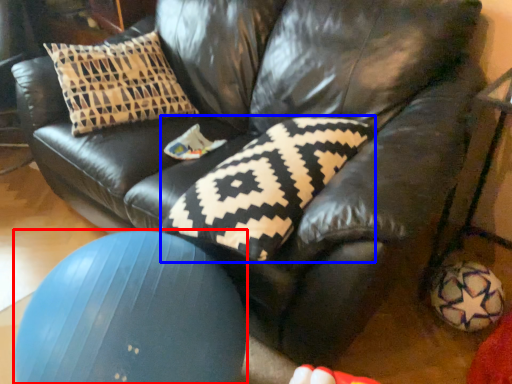
Question: Among these objects, which one is nearest to the camera, ball (highlighted by a red box) or pillow (highlighted by a blue box)?

Choices:
 (A) ball
 (B) pillow

Answer: (A)